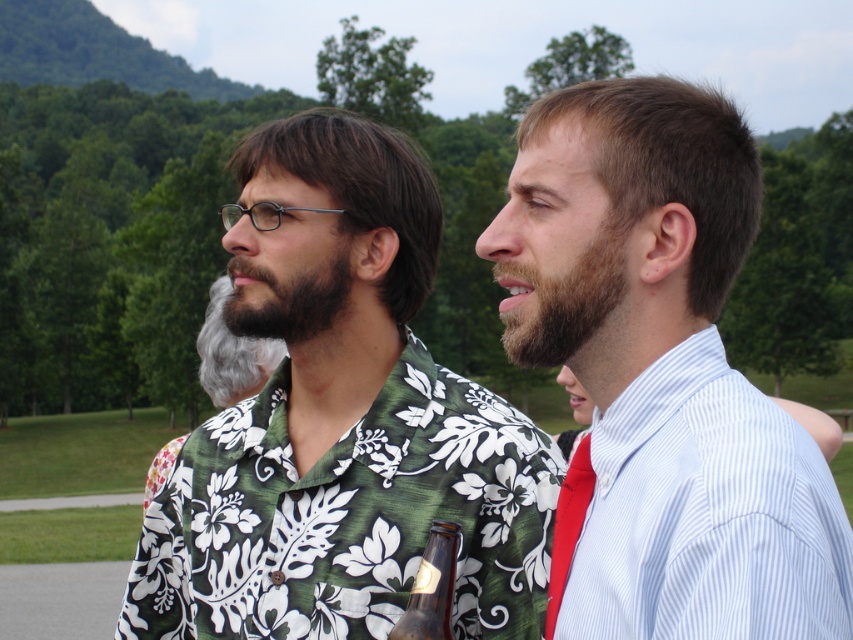
You are a photographer setting up a camera to capture the two people in the scene. The camera has a fixed width of 1 meter. If you want to frame both the light blue striped shirt at center and the white striped dress shirt at right in the same shot without moving the camera, will the shirts fit within the camera frame?

The light blue striped shirt at center might be wider than the white striped dress shirt at right, so the total width required to frame both could exceed the camera frame of 1 meter. Therefore, it is uncertain if they will fit without adjusting the camera angle or zoom.

You are a tailor measuring clothing items for alterations. You need to determine which item requires more fabric for adjustments between the green floral shirt at center and the red satin tie at right. Which one needs more fabric?

The green floral shirt at center requires more fabric for adjustments because its width is larger than the red satin tie at right.